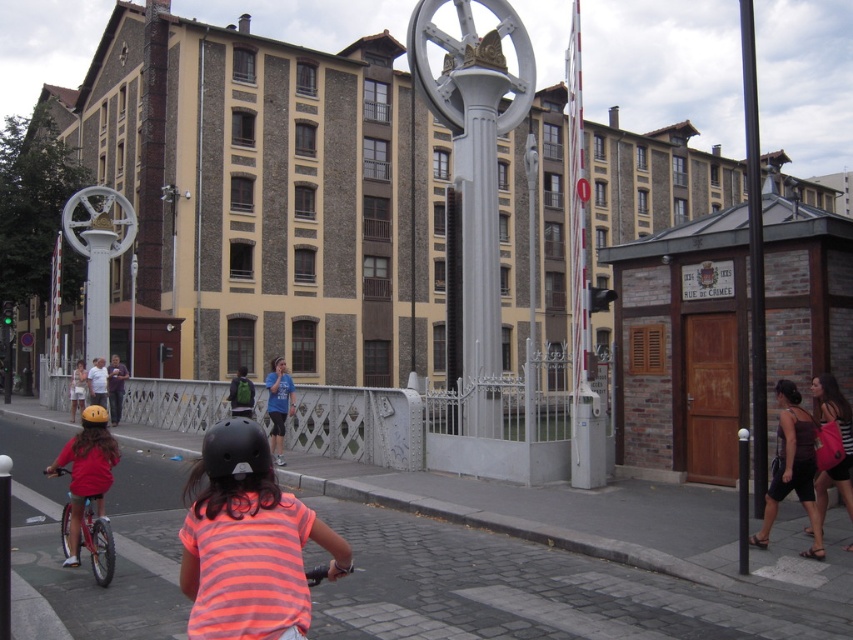
Question: Is blue t-shirt at center further to the viewer compared to green backpack at center?

Choices:
 (A) yes
 (B) no

Answer: (B)

Question: Is orange striped shirt at center in front of silver metallic bicycle at left?

Choices:
 (A) yes
 (B) no

Answer: (A)

Question: Which of the following is the farthest from the observer?

Choices:
 (A) 202,593
 (B) 218,428

Answer: (B)

Question: Among these objects, which one is farthest from the camera?

Choices:
 (A) light blue shirt at center
 (B) blue t-shirt at center
 (C) black matte helmet at center

Answer: (A)

Question: Is black metal pole at right thinner than blue t-shirt at center?

Choices:
 (A) no
 (B) yes

Answer: (A)

Question: Which object is the farthest from the dark brown fabric dress at lower right?

Choices:
 (A) orange matte bicycle helmet at rear
 (B) pink fabric bag at right

Answer: (A)